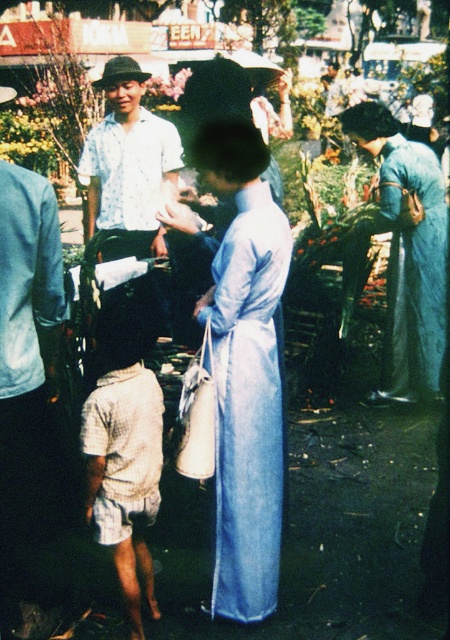
You are a photographer at the market and want to capture both the white checkered shorts at lower left and the light blue shirt at center in a single photo. Which object should you focus on first to ensure both are in clear view?

You should focus on the white checkered shorts at lower left first because it is closer to the viewer than the light blue shirt at center, ensuring both will be in focus when focused on the closer object.

You are a tailor in this market and need to determine which item of clothing is smaller between the white checkered shorts at lower left and the light blue shirt at center. Based on the scene, which one should you choose?

The white checkered shorts at lower left has a smaller size compared to the light blue shirt at center, so the tailor should choose the white checkered shorts at lower left as the smaller item.

You are a photographer at the market and want to capture both the light blue silk ao dai at center and the light blue shirt at center in the same frame. Which one is on the right side when viewed from your camera position?

The light blue silk ao dai at center is positioned on the right side of the light blue shirt at center, so the light blue silk ao dai at center is on the right side in the frame.